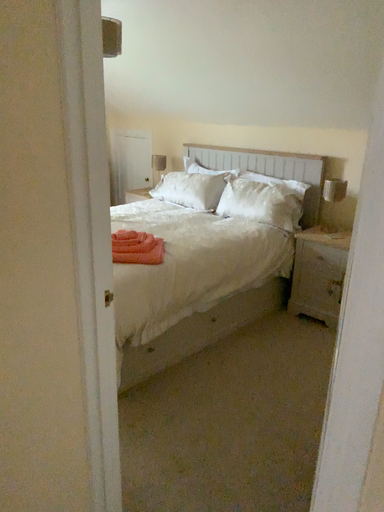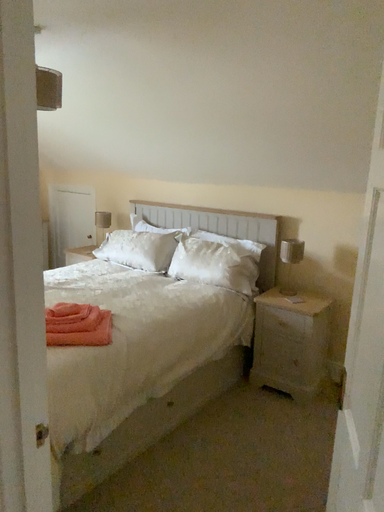
Question: Which way did the camera rotate in the video?

Choices:
 (A) rotated downward
 (B) rotated upward

Answer: (B)